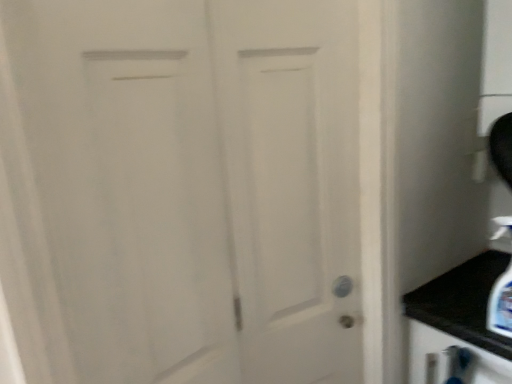
Question: From a real-world perspective, is white matte door at center positioned over clear plastic soap dispenser at lower right based on gravity?

Choices:
 (A) yes
 (B) no

Answer: (A)

Question: Can you confirm if white matte door at center is smaller than clear plastic soap dispenser at lower right?

Choices:
 (A) no
 (B) yes

Answer: (A)

Question: Could clear plastic soap dispenser at lower right be considered to be inside white matte door at center?

Choices:
 (A) yes
 (B) no

Answer: (B)

Question: Is white matte door at center to the left of clear plastic soap dispenser at lower right from the viewer's perspective?

Choices:
 (A) yes
 (B) no

Answer: (A)

Question: Is white matte door at center bigger than clear plastic soap dispenser at lower right?

Choices:
 (A) yes
 (B) no

Answer: (A)

Question: Is white matte door at center looking in the opposite direction of clear plastic soap dispenser at lower right?

Choices:
 (A) yes
 (B) no

Answer: (B)

Question: Is clear plastic soap dispenser at lower right in contact with white matte door at center?

Choices:
 (A) yes
 (B) no

Answer: (B)

Question: From the image's perspective, does clear plastic soap dispenser at lower right appear lower than white matte door at center?

Choices:
 (A) no
 (B) yes

Answer: (B)

Question: Is clear plastic soap dispenser at lower right facing towards white matte door at center?

Choices:
 (A) yes
 (B) no

Answer: (B)

Question: Considering the relative sizes of clear plastic soap dispenser at lower right and white matte door at center in the image provided, is clear plastic soap dispenser at lower right shorter than white matte door at center?

Choices:
 (A) no
 (B) yes

Answer: (B)

Question: From a real-world perspective, is clear plastic soap dispenser at lower right located beneath white matte door at center?

Choices:
 (A) yes
 (B) no

Answer: (A)

Question: Is clear plastic soap dispenser at lower right smaller than white matte door at center?

Choices:
 (A) no
 (B) yes

Answer: (B)

Question: From the image's perspective, is white matte door at center above or below clear plastic soap dispenser at lower right?

Choices:
 (A) below
 (B) above

Answer: (B)